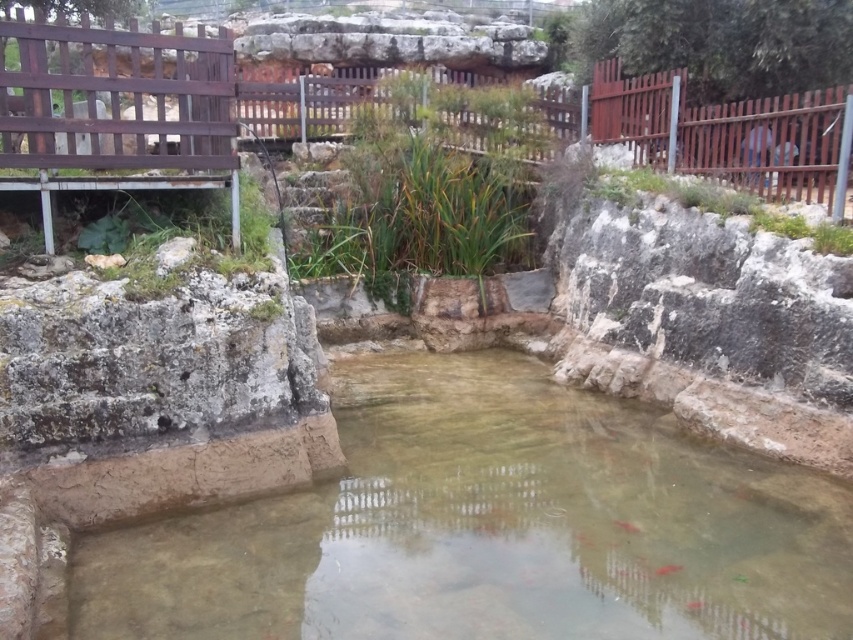
Question: Which point is closer to the camera?

Choices:
 (A) (634, 531)
 (B) (375, 560)

Answer: (B)

Question: Does smooth stone pond at center appear on the right side of translucent pink fish at center?

Choices:
 (A) yes
 (B) no

Answer: (B)

Question: Estimate the real-world distances between objects in this image. Which object is closer to the translucent pink fish at center?

Choices:
 (A) smooth stone pond at center
 (B) shiny orange fish at center

Answer: (B)

Question: Where is smooth stone pond at center located in relation to shiny orange fish at center in the image?

Choices:
 (A) left
 (B) right

Answer: (A)

Question: Which object appears farthest from the camera in this image?

Choices:
 (A) translucent pink fish at center
 (B) shiny orange fish at center

Answer: (A)

Question: Can you confirm if smooth stone pond at center is thinner than translucent pink fish at center?

Choices:
 (A) yes
 (B) no

Answer: (B)